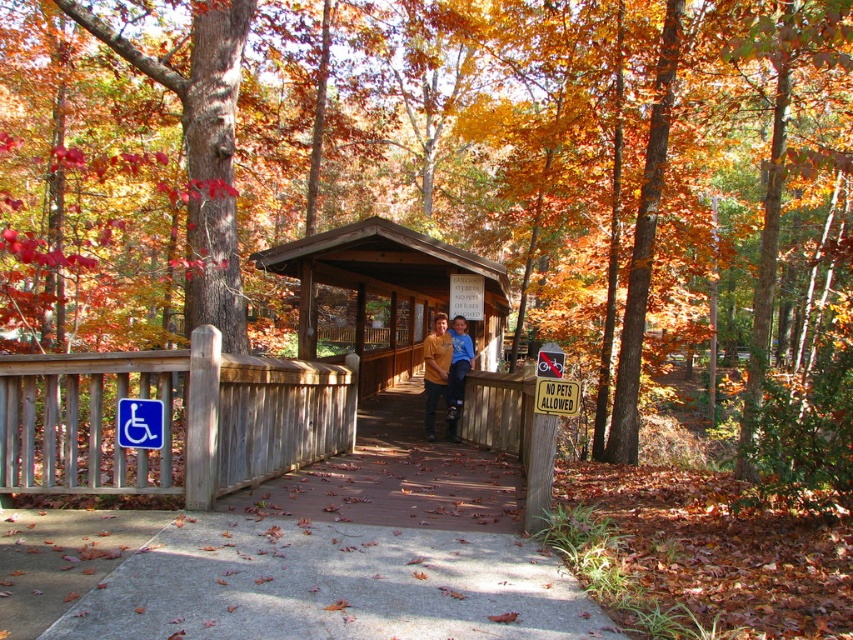
You are planning to cross the wooden covered bridge and need to determine if the two people wearing the matte yellow shirt at center and blue cotton shirt at center can walk side by side on the bridge. The bridge has a width of 1.2 meters. The combined width of the two people is 1 meter. Can they comfortably walk side by side?

The matte yellow shirt at center has a larger size compared to blue cotton shirt at center. Since the combined width of the two people is 1 meter and the bridge is 1.2 meters wide, they can comfortably walk side by side with 0.2 meters of space remaining.

You are planning to take a photo of the wooden gazebo at center and the blue cotton shirt at center from a position where both are visible. Considering their heights, which object should you adjust your camera angle to focus on first to ensure both are in frame?

The wooden gazebo at center is taller than the blue cotton shirt at center, so you should first focus on the wooden gazebo at center to ensure its full height is captured before adjusting the angle to include the blue cotton shirt at center.